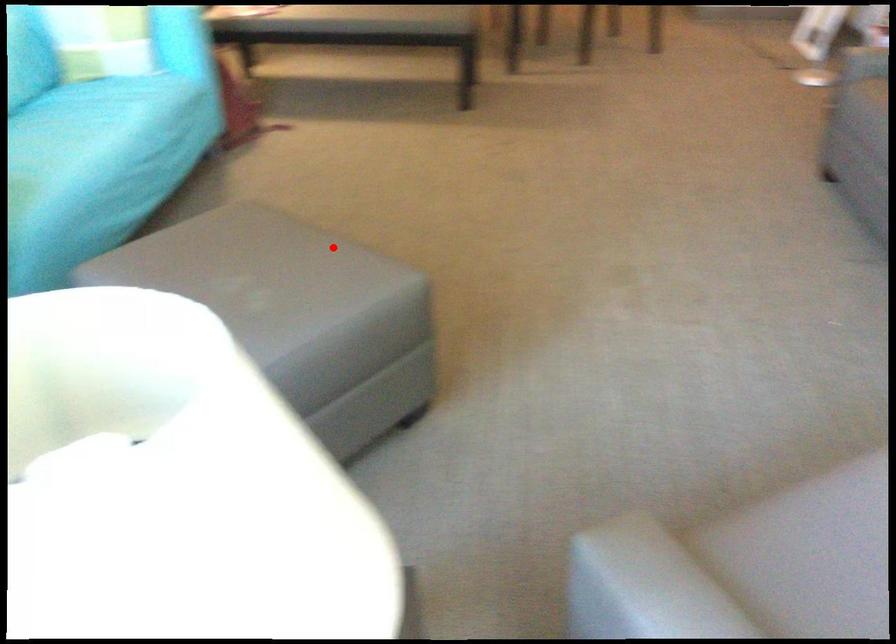
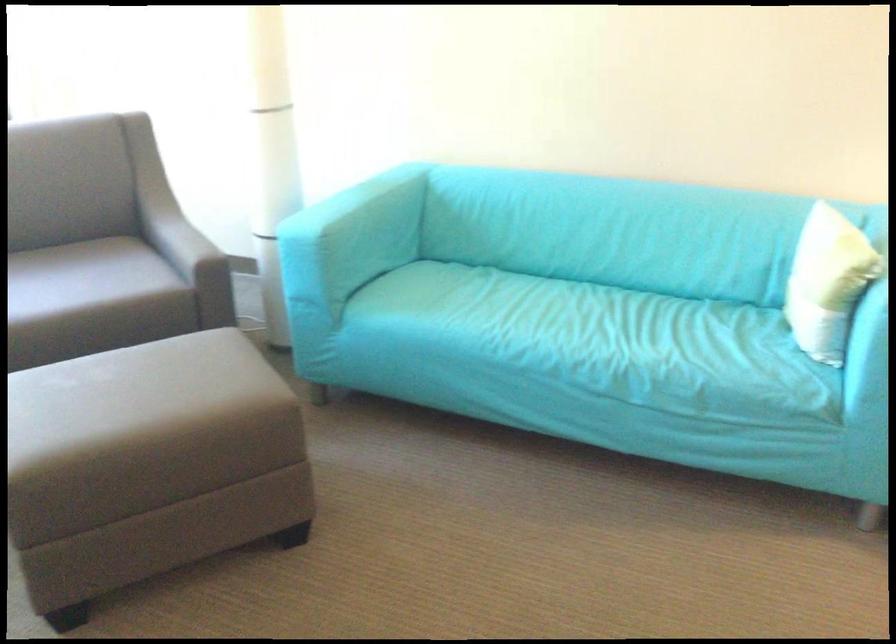
Question: I am providing you with two images of the same scene from different viewpoints. A red point is marked on the first image. At the location where the point appears in image 1, is it still visible in image 2?

Choices:
 (A) Yes
 (B) No

Answer: (A)